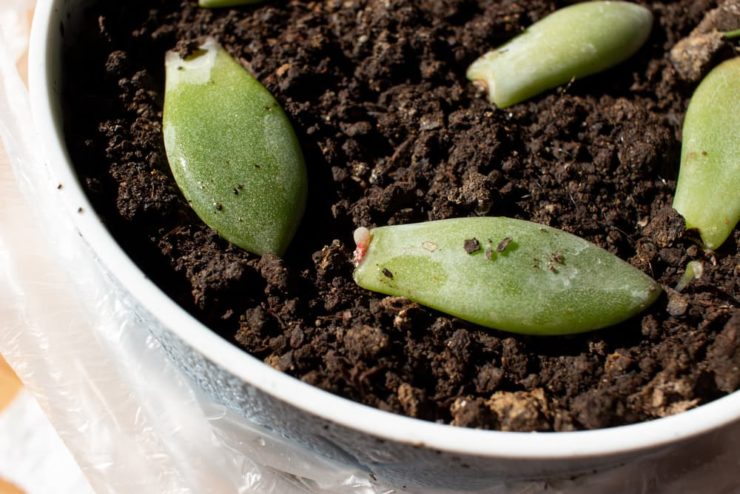
The image size is (740, 494). Identify the location of side of ceramic planter. (292, 429).